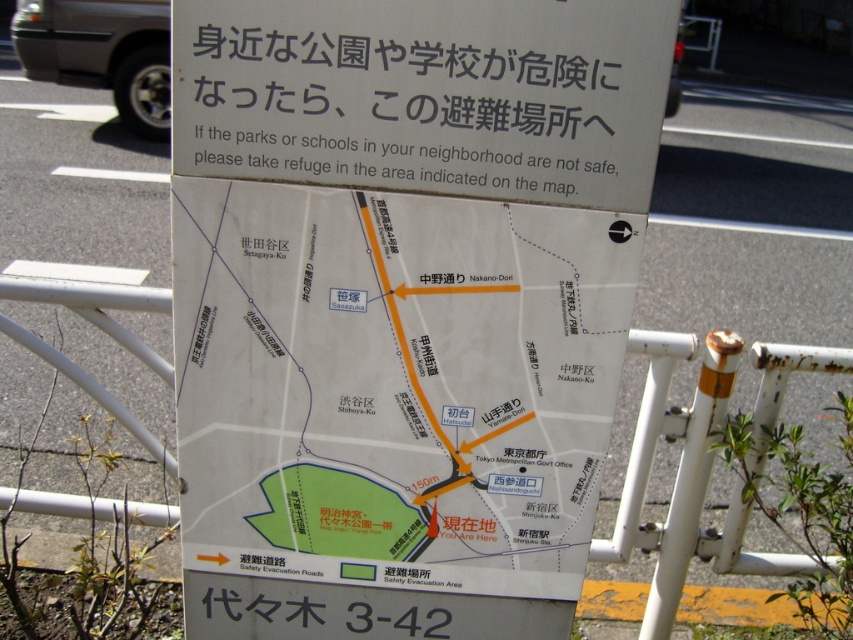
You are a tourist holding a phone with a 10cm wide screen. You want to view both the white paper map at center and the white paper sign at upper center on your phone. Which one is more likely to fit without needing to zoom in?

The white paper sign at upper center is more likely to fit on the phone screen without zooming because its width is narrower than the white paper map at center, which is wider and may exceed the 10cm screen width.

You are a tourist trying to read the white paper sign at upper center but notice the rusty metal pole at right is blocking your view. Can you see the entire sign clearly?

The white paper sign at upper center is in front of the rusty metal pole at right, so it is not blocked by the pole and you can see the entire sign clearly.

You are looking at a signboard with a map and instructions. The white paper map at center and the white paper sign at upper center are both present. Which object is positioned to the left of the other?

The white paper map at center is to the left of white paper sign at upper center.